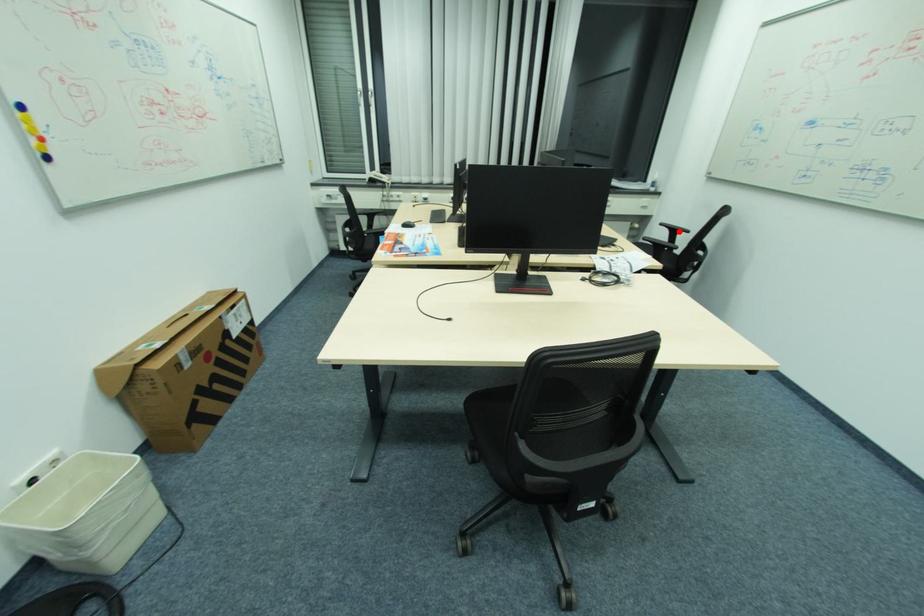
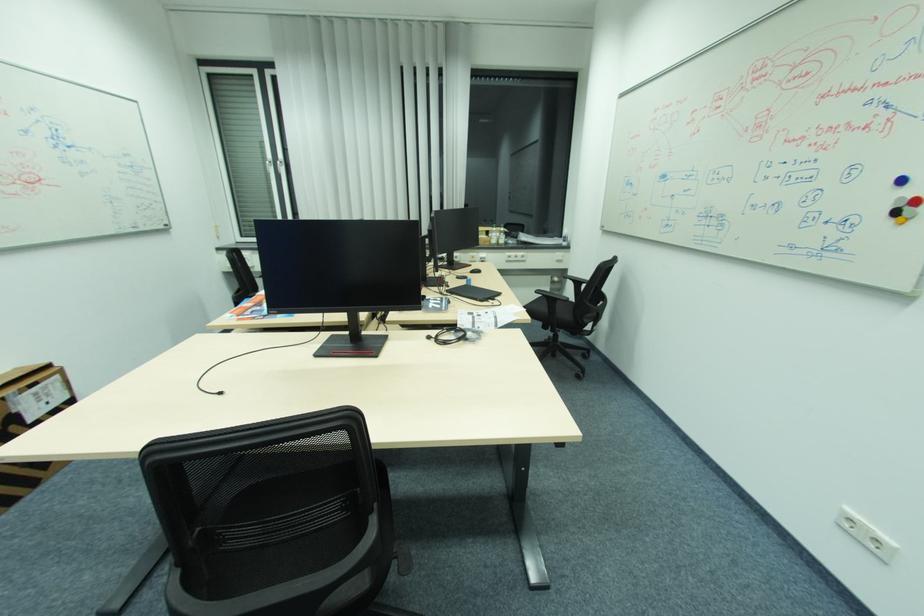
Where in the second image is the point corresponding to the highlighted location from the first image?

(584, 283)